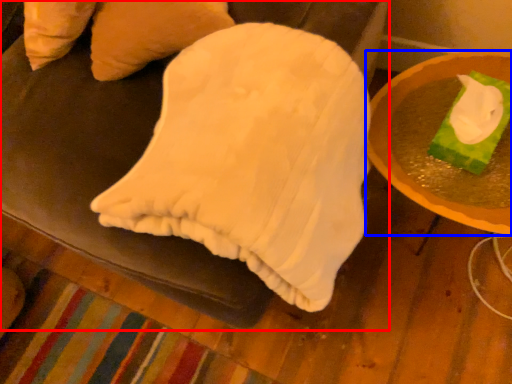
Question: Which of the following is the farthest to the observer, furniture (highlighted by a red box) or table (highlighted by a blue box)?

Choices:
 (A) furniture
 (B) table

Answer: (B)